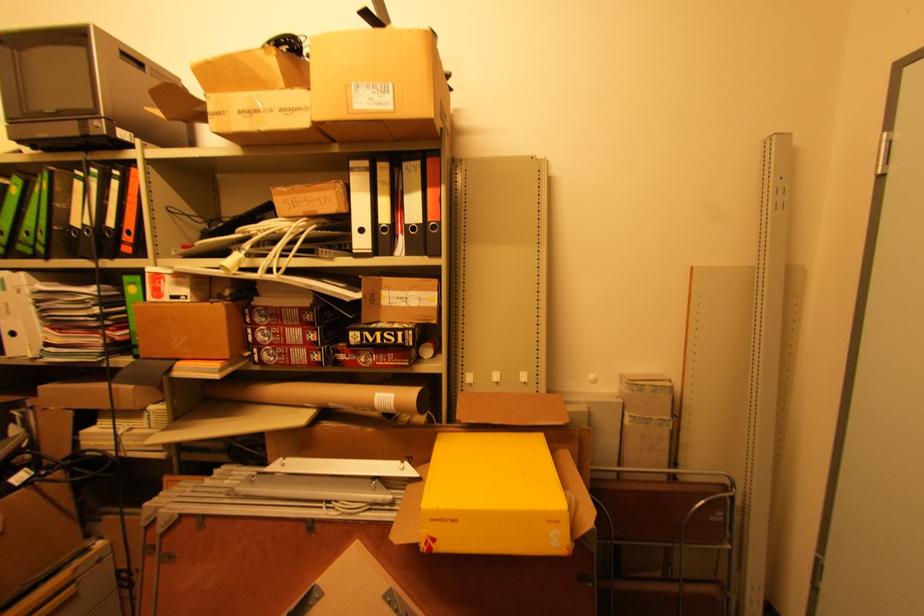
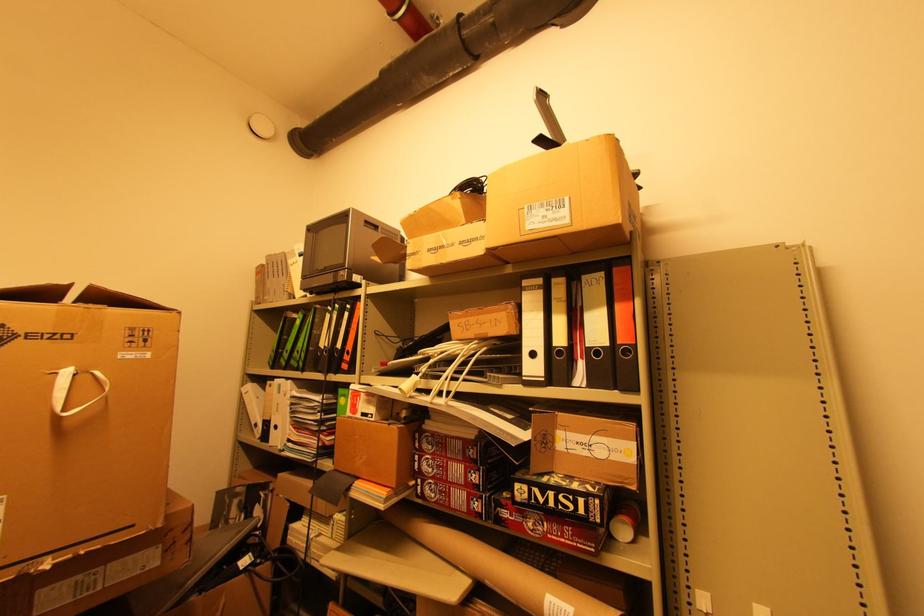
Locate, in the second image, the point that corresponds to (x=123, y=137) in the first image.

(358, 281)